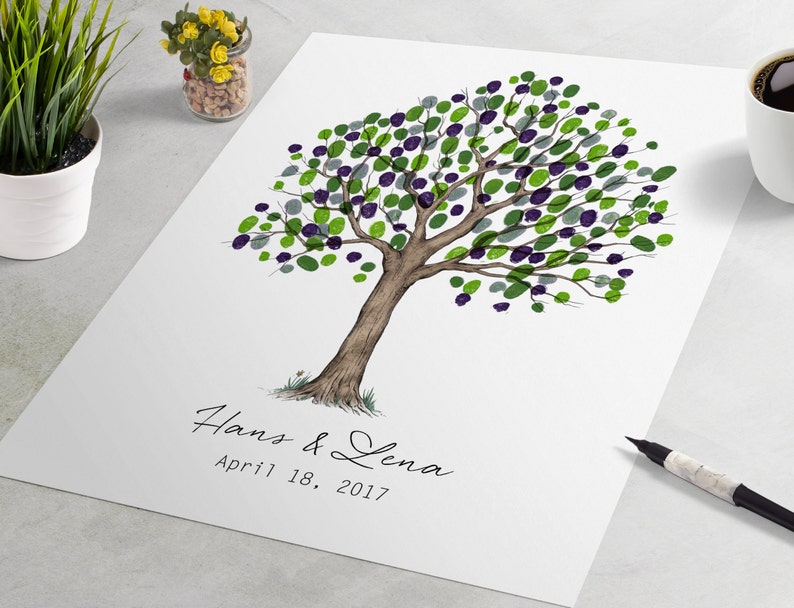
At what (x,y) coordinates should I click in order to perform the action: click on table. Please return your answer as a coordinate pair (x, y). Looking at the image, I should click on (194, 582).